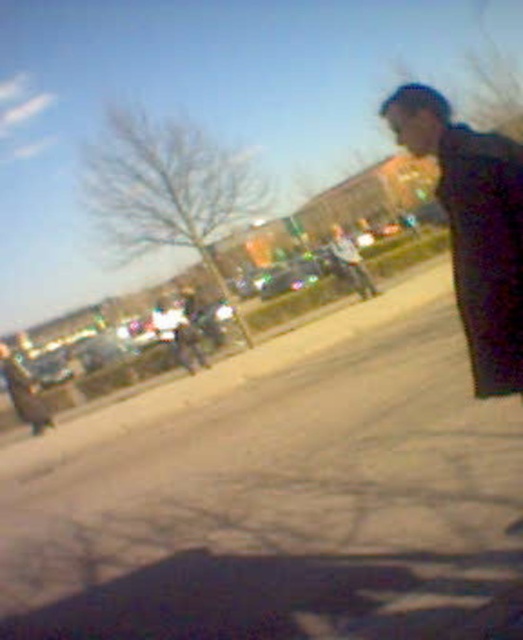
You are standing on the gray asphalt pavement at center and want to walk towards the dark gray jacket at right. Which direction should you move?

You should move to the right because the gray asphalt pavement at center is to the left of the dark gray jacket at right.

You are standing on the gray asphalt pavement at center and want to walk to the dark gray jacket at right. Which direction should you move to reach it?

The dark gray jacket at right is above the gray asphalt pavement at center, so you should move upward to reach it.